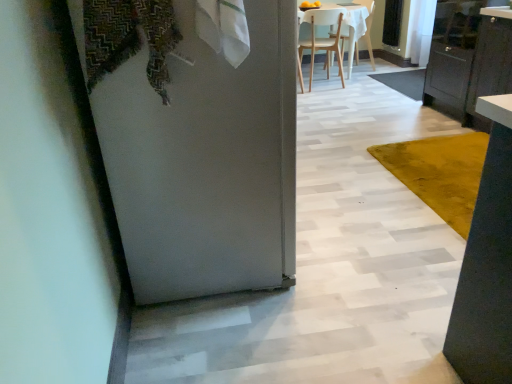
Question: Is wooden chair at upper center, which is the first chair in right-to-left order, thinner than yellow velvet rug at center?

Choices:
 (A) no
 (B) yes

Answer: (B)

Question: From a real-world perspective, is wooden chair at upper center, which is the first chair in right-to-left order, over yellow velvet rug at center?

Choices:
 (A) yes
 (B) no

Answer: (A)

Question: Is wooden chair at upper center, positioned as the second chair in left-to-right order, aimed at yellow velvet rug at center?

Choices:
 (A) yes
 (B) no

Answer: (B)

Question: From a real-world perspective, is wooden chair at upper center, positioned as the second chair in left-to-right order, beneath yellow velvet rug at center?

Choices:
 (A) no
 (B) yes

Answer: (A)

Question: From the image's perspective, is wooden chair at upper center, positioned as the second chair in left-to-right order, located beneath yellow velvet rug at center?

Choices:
 (A) no
 (B) yes

Answer: (A)

Question: Does wooden chair at upper center, which is the first chair in right-to-left order, lie in front of yellow velvet rug at center?

Choices:
 (A) no
 (B) yes

Answer: (A)

Question: Can you confirm if clear glass screen door at upper right is taller than black glossy cabinet at right?

Choices:
 (A) yes
 (B) no

Answer: (B)

Question: Is clear glass screen door at upper right in front of black glossy cabinet at right?

Choices:
 (A) no
 (B) yes

Answer: (A)

Question: Is clear glass screen door at upper right bigger than black glossy cabinet at right?

Choices:
 (A) no
 (B) yes

Answer: (A)

Question: Could black glossy cabinet at right be considered to be inside clear glass screen door at upper right?

Choices:
 (A) no
 (B) yes

Answer: (A)

Question: Can you confirm if clear glass screen door at upper right is positioned to the right of black glossy cabinet at right?

Choices:
 (A) no
 (B) yes

Answer: (A)

Question: Considering the relative sizes of clear glass screen door at upper right and black glossy cabinet at right in the image provided, is clear glass screen door at upper right thinner than black glossy cabinet at right?

Choices:
 (A) yes
 (B) no

Answer: (A)

Question: Can you confirm if clear glass screen door at upper right is shorter than patterned fabric laundry at upper left?

Choices:
 (A) no
 (B) yes

Answer: (A)